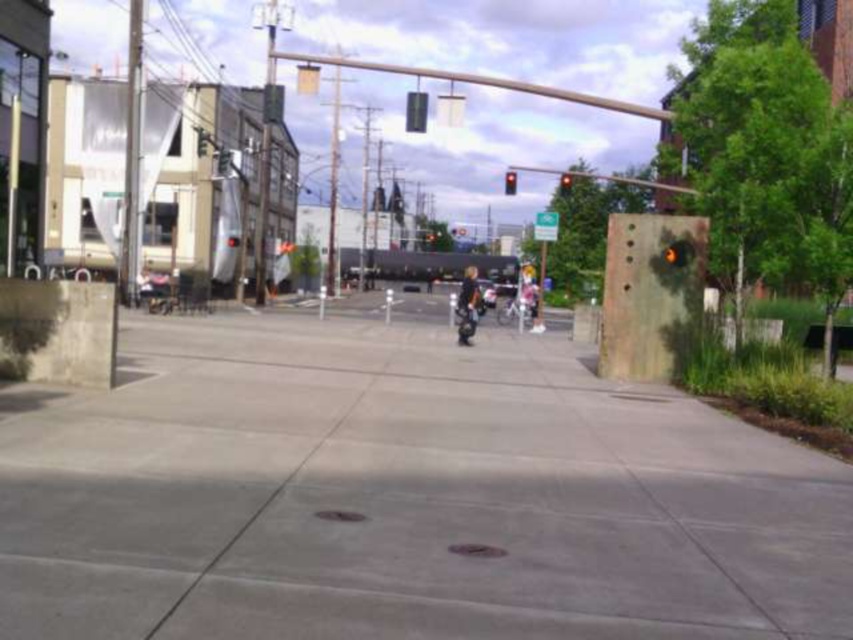
Question: Is silver metallic pole at left positioned before metallic traffic light at center?

Choices:
 (A) yes
 (B) no

Answer: (B)

Question: Among these objects, which one is nearest to the camera?

Choices:
 (A) red glass traffic light at center
 (B) black glass traffic light at center

Answer: (B)

Question: Estimate the real-world distances between objects in this image. Which object is closer to the black glass traffic light at center?

Choices:
 (A) red glass traffic light at upper center
 (B) metallic traffic light at center
 (C) gray concrete pavement at center

Answer: (C)

Question: Is metallic traffic light at center to the left of black glass traffic light at center from the viewer's perspective?

Choices:
 (A) no
 (B) yes

Answer: (B)

Question: Does red glass traffic light at center appear under red glass traffic light at upper center?

Choices:
 (A) no
 (B) yes

Answer: (A)

Question: Which point is closer to the camera?

Choices:
 (A) gray concrete pavement at center
 (B) dark blue jeans at center
 (C) red glass traffic light at center

Answer: (A)